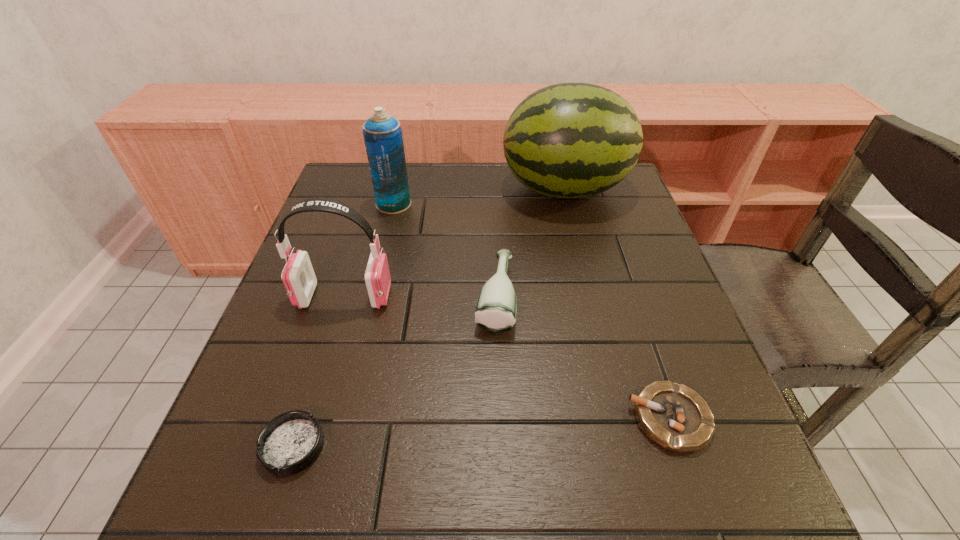
Where is `watermelon`? This screenshot has width=960, height=540. watermelon is located at coordinates (572, 140).

Where is `aerosol can`? The width and height of the screenshot is (960, 540). aerosol can is located at coordinates (383, 138).

This screenshot has height=540, width=960. In order to click on earphone in this screenshot , I will do `click(298, 277)`.

Identify the location of the third shortest object. (496, 308).

Where is `the right ashtray`? The width and height of the screenshot is (960, 540). the right ashtray is located at coordinates coord(675,417).

Find the location of a particular element. Image resolution: width=960 pixels, height=540 pixels. the second shortest object is located at coordinates (675, 417).

Locate an element on the screen. the left ashtray is located at coordinates (289, 443).

Find the location of a particular element. the shortest object is located at coordinates (289, 443).

Image resolution: width=960 pixels, height=540 pixels. I want to click on free space located at the stem end of the watermelon, so click(x=361, y=190).

You are a GUI agent. You are given a task and a screenshot of the screen. Output one action in this format:
    pyautogui.click(x=<x>, y=<y>)
    Task: Click on the free space located 0.180m at the stem end of the watermelon
    The height and width of the screenshot is (540, 960).
    Given the screenshot: What is the action you would take?
    pyautogui.click(x=437, y=190)